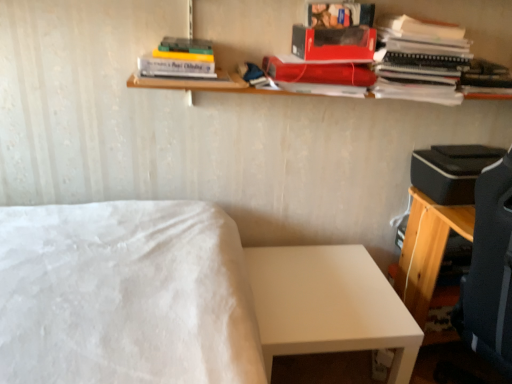
Question: Considering the relative positions of matte red paperback book at upper center, which is counted as the third paperback book, starting from the bottom, and white matte table at lower right in the image provided, is matte red paperback book at upper center, which is counted as the third paperback book, starting from the bottom, to the left or to the right of white matte table at lower right?

Choices:
 (A) right
 (B) left

Answer: (A)

Question: From a real-world perspective, relative to white matte table at lower right, is matte red paperback book at upper center, the first paperback book viewed from the top, vertically above or below?

Choices:
 (A) above
 (B) below

Answer: (A)

Question: Estimate the real-world distances between objects in this image. Which object is closer to the shiny red paperback book at upper center, marked as the 2th paperback book in a bottom-to-top arrangement?

Choices:
 (A) hardcover book at upper center, the 1th book in the left-to-right sequence
 (B) matte red paperback book at upper center, the first paperback book viewed from the top
 (C) matte black notebook at upper right, placed as the first book when sorted from right to left
 (D) matte red paperback book at upper center, which is the 1th paperback book in bottom-to-top order
 (E) wooden shelf at upper center

Answer: (D)

Question: Which object is the closest to the white matte table at lower right?

Choices:
 (A) shiny red paperback book at upper center, which is counted as the second paperback book, starting from the top
 (B) white matte bed at center
 (C) matte red book at upper right, arranged as the 2th book when viewed from the right
 (D) matte black notebook at upper right, placed as the first book when sorted from right to left
 (E) wooden shelf at upper center

Answer: (B)